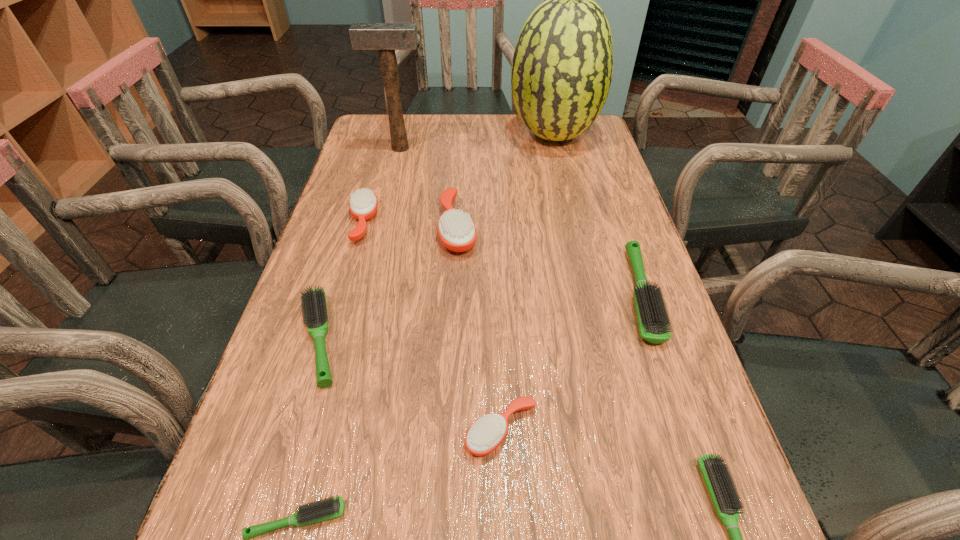
Identify the location of object situated at the far left corner. (386, 37).

You are a GUI agent. You are given a task and a screenshot of the screen. Output one action in this format:
    pyautogui.click(x=<x>, y=<y>)
    Task: Click on the object positioned at the far right corner
    The height and width of the screenshot is (540, 960).
    Given the screenshot: What is the action you would take?
    pyautogui.click(x=562, y=66)

In the image, there is a desktop. What are the coordinates of `blank space at the far edge` in the screenshot? It's located at (491, 137).

Find the location of a particular element. This screenshot has height=540, width=960. free space at the left edge of the desktop is located at coordinates (265, 405).

This screenshot has height=540, width=960. Identify the location of vacant region at the right edge of the desktop. (578, 203).

This screenshot has width=960, height=540. In order to click on free region at the far left corner of the desktop in this screenshot , I will do `click(371, 136)`.

The width and height of the screenshot is (960, 540). Identify the location of vacant area at the far right corner. (578, 145).

Image resolution: width=960 pixels, height=540 pixels. I want to click on free space between the watermelon and the mallet, so click(x=477, y=141).

Identify the location of vacant region between the smallest orange hairbrush and the green watermelon. Image resolution: width=960 pixels, height=540 pixels. (527, 283).

Locate an element on the screen. This screenshot has height=540, width=960. empty space that is in between the nearest orange hairbrush and the tallest hairbrush is located at coordinates (480, 329).